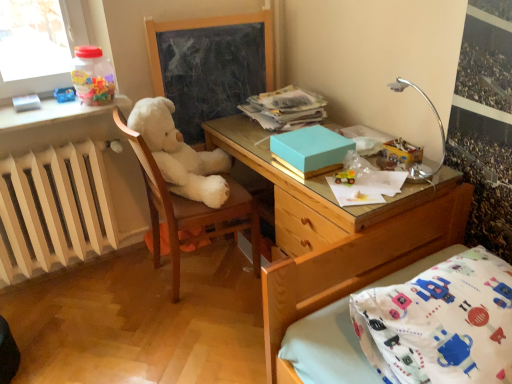
Question: Is wooden bed frame at lower right inside white painted radiator at left?

Choices:
 (A) no
 (B) yes

Answer: (A)

Question: From the image's perspective, is white painted radiator at left below wooden bed frame at lower right?

Choices:
 (A) yes
 (B) no

Answer: (B)

Question: Can you confirm if white painted radiator at left is bigger than wooden bed frame at lower right?

Choices:
 (A) no
 (B) yes

Answer: (B)

Question: Could you tell me if white painted radiator at left is turned towards wooden bed frame at lower right?

Choices:
 (A) yes
 (B) no

Answer: (A)

Question: Is the depth of white painted radiator at left less than that of wooden bed frame at lower right?

Choices:
 (A) yes
 (B) no

Answer: (B)

Question: Which is correct: transparent plastic container at upper left is inside teal matte box at center, or outside of it?

Choices:
 (A) inside
 (B) outside

Answer: (B)

Question: Would you say transparent plastic container at upper left is to the left or to the right of teal matte box at center in the picture?

Choices:
 (A) right
 (B) left

Answer: (B)

Question: Is transparent plastic container at upper left in front of or behind teal matte box at center in the image?

Choices:
 (A) behind
 (B) front

Answer: (A)

Question: Looking at the image, does transparent plastic container at upper left seem bigger or smaller compared to teal matte box at center?

Choices:
 (A) small
 (B) big

Answer: (B)

Question: From their relative heights in the image, would you say light blue cardboard book at upper center is taller or shorter than smooth blackboard at center?

Choices:
 (A) tall
 (B) short

Answer: (B)

Question: Looking at the image, does light blue cardboard book at upper center seem bigger or smaller compared to smooth blackboard at center?

Choices:
 (A) small
 (B) big

Answer: (A)

Question: Considering the positions of point (267, 92) and point (229, 59), is point (267, 92) closer or farther from the camera than point (229, 59)?

Choices:
 (A) farther
 (B) closer

Answer: (A)

Question: Is light blue cardboard book at upper center wider or thinner than smooth blackboard at center?

Choices:
 (A) wide
 (B) thin

Answer: (A)

Question: Is white painted radiator at left spatially inside transparent plastic container at upper left, or outside of it?

Choices:
 (A) outside
 (B) inside

Answer: (A)

Question: From a real-world perspective, is white painted radiator at left above or below transparent plastic container at upper left?

Choices:
 (A) below
 (B) above

Answer: (A)